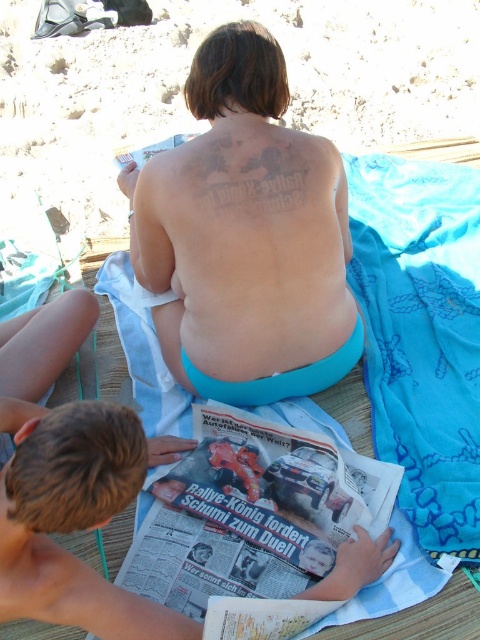
Question: Can you confirm if blue fabric towel at upper center is positioned above blue fabric towel at lower right?

Choices:
 (A) yes
 (B) no

Answer: (A)

Question: Which point is farther from the camera taking this photo?

Choices:
 (A) (304, 147)
 (B) (374, 314)
 (C) (109, 118)

Answer: (C)

Question: Estimate the real-world distances between objects in this image. Which object is farther from the blue fabric towel at upper center?

Choices:
 (A) blue fabric towel at center
 (B) skinny blue shorts at center

Answer: (B)

Question: Can you confirm if blue fabric towel at center is positioned to the right of blue fabric towel at lower right?

Choices:
 (A) no
 (B) yes

Answer: (A)

Question: Is skinny blue shorts at center to the right of blue fabric towel at lower right from the viewer's perspective?

Choices:
 (A) yes
 (B) no

Answer: (B)

Question: Estimate the real-world distances between objects in this image. Which object is farther from the blue fabric towel at lower right?

Choices:
 (A) blue fabric towel at upper center
 (B) blue fabric towel at center

Answer: (A)